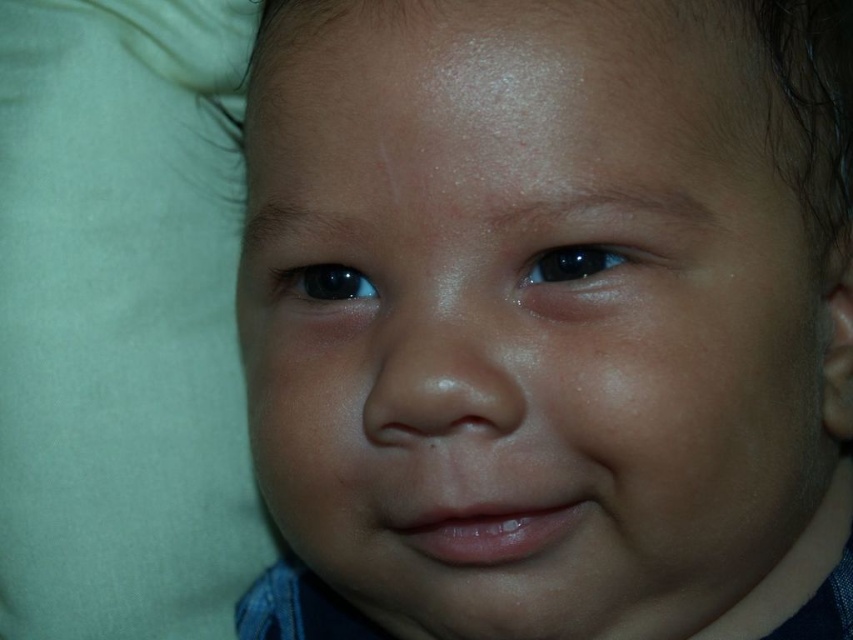
In the scene shown: Between black glossy eye at upper center and glossy black eye at upper center, which one is positioned lower?

Positioned lower is glossy black eye at upper center.

This screenshot has height=640, width=853. In order to click on black glossy eye at upper center in this screenshot , I will do `click(573, 262)`.

Identify the location of black glossy eye at upper center. (573, 262).

Image resolution: width=853 pixels, height=640 pixels. I want to click on smooth skin baby at center, so click(531, 312).

Is smooth skin baby at center to the right of black glossy eye at upper center from the viewer's perspective?

Incorrect, smooth skin baby at center is not on the right side of black glossy eye at upper center.

Between point (608, 442) and point (583, 253), which one is positioned behind?

Positioned behind is point (583, 253).

What are the coordinates of `smooth skin baby at center` in the screenshot? It's located at (531, 312).

Who is higher up, smooth skin baby at center or glossy black eye at upper center?

glossy black eye at upper center is higher up.

Between smooth skin baby at center and glossy black eye at upper center, which one appears on the right side from the viewer's perspective?

smooth skin baby at center is more to the right.

Where is `smooth skin baby at center`? This screenshot has height=640, width=853. smooth skin baby at center is located at coordinates (531, 312).